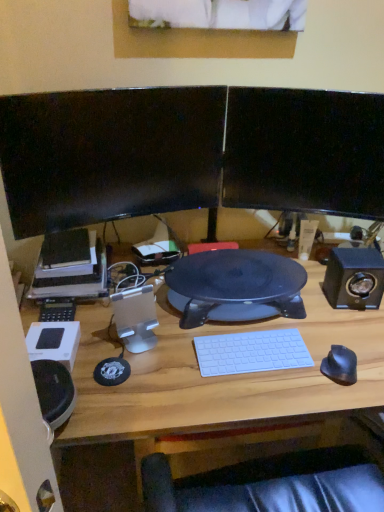
Find the location of a particular element. free location to the left of black matte speaker at right, which ranks as the 2th speaker in left-to-right order is located at coordinates (306, 306).